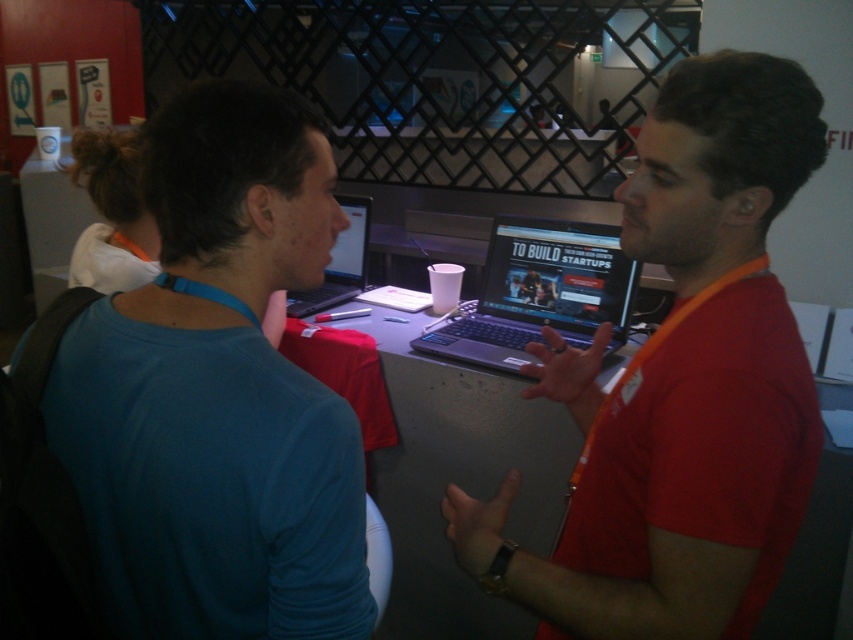
Question: Is blue fabric shirt at upper left smaller than matte black laptop at center?

Choices:
 (A) yes
 (B) no

Answer: (B)

Question: Can you confirm if blue fabric shirt at upper left is wider than silver metallic laptop at center?

Choices:
 (A) no
 (B) yes

Answer: (A)

Question: Which of these objects is positioned farthest from the orange fabric shirt at center?

Choices:
 (A) matte black laptop at center
 (B) silver metallic laptop at center
 (C) blue fabric shirt at upper left

Answer: (A)

Question: Which object is positioned closest to the matte black laptop at center?

Choices:
 (A) orange fabric shirt at center
 (B) blue fabric shirt at upper left

Answer: (A)

Question: Estimate the real-world distances between objects in this image. Which object is closer to the matte black laptop at center?

Choices:
 (A) blue fabric shirt at upper left
 (B) silver metallic laptop at center

Answer: (B)

Question: Considering the relative positions of orange fabric shirt at center and matte black laptop at center in the image provided, where is orange fabric shirt at center located with respect to matte black laptop at center?

Choices:
 (A) right
 (B) left

Answer: (A)